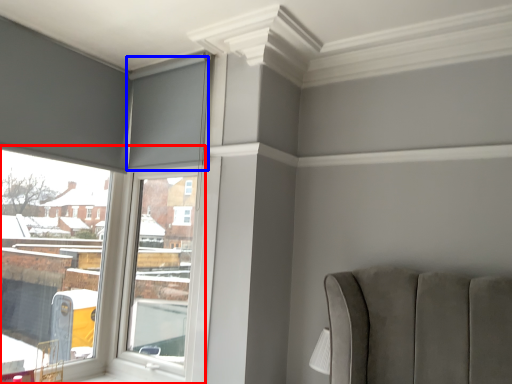
Question: Among these objects, which one is farthest to the camera, window (highlighted by a red box) or curtain (highlighted by a blue box)?

Choices:
 (A) window
 (B) curtain

Answer: (B)